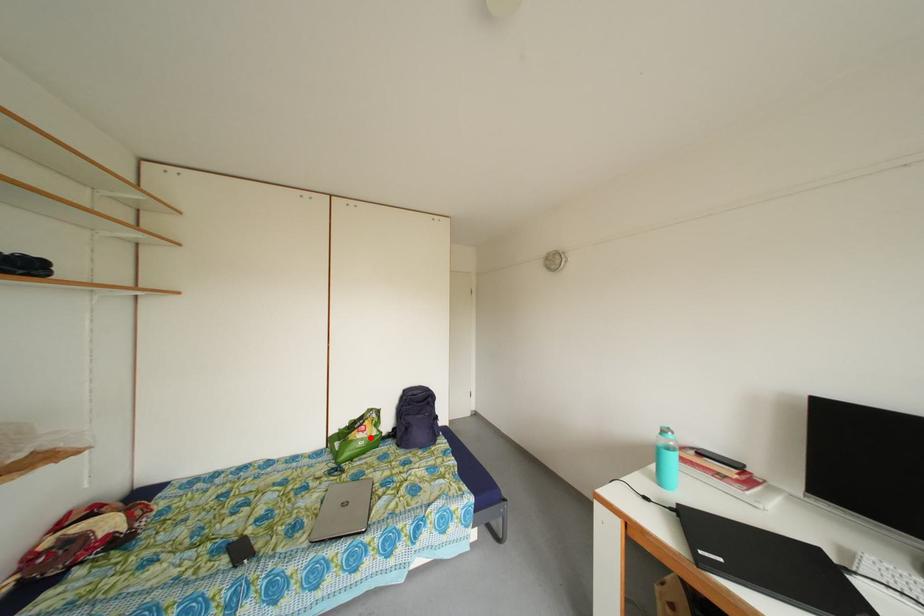
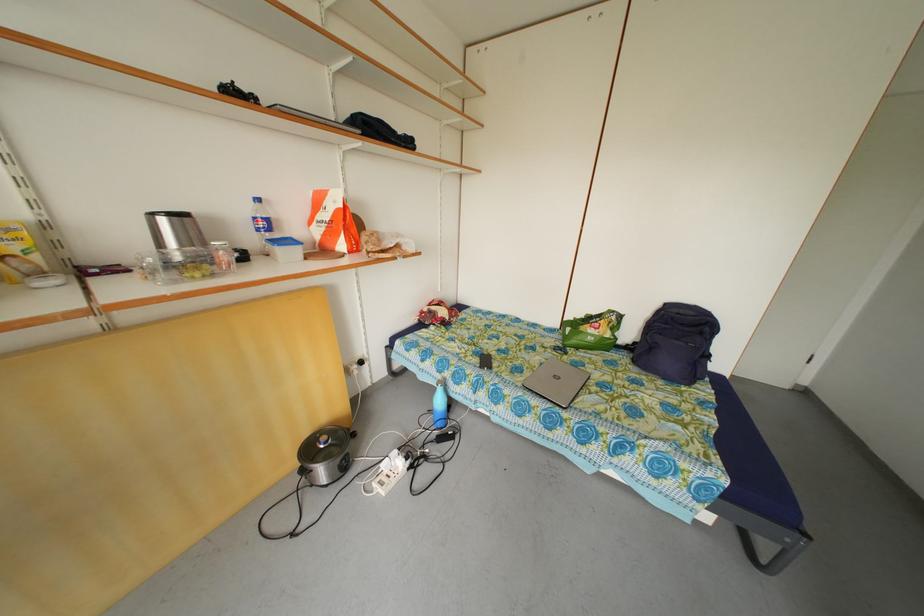
Question: I am providing you with two images of the same scene from different viewpoints. A red point is shown in image1. For the corresponding object point in image2, is it positioned nearer or farther from the camera?

Choices:
 (A) Nearer
 (B) Farther

Answer: (A)